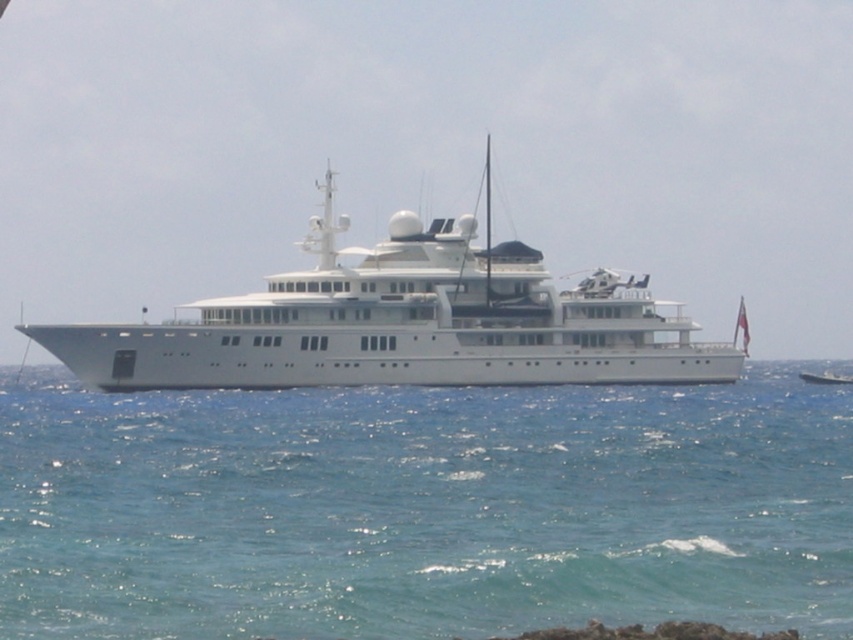
Is white glossy cruise ship at center shorter than white glossy yacht at center?

Incorrect, white glossy cruise ship at center's height does not fall short of white glossy yacht at center's.

Does white glossy cruise ship at center have a larger size compared to white glossy yacht at center?

Yes, white glossy cruise ship at center is bigger than white glossy yacht at center.

Does point (360, 374) come in front of point (828, 376)?

Yes, it is in front of point (828, 376).

At what (x,y) coordinates should I click in order to perform the action: click on white glossy cruise ship at center. Please return your answer as a coordinate pair (x, y). Looking at the image, I should click on (405, 323).

Does clear blue water at center have a greater width compared to white glossy cruise ship at center?

No, clear blue water at center is not wider than white glossy cruise ship at center.

Can you confirm if clear blue water at center is positioned below white glossy cruise ship at center?

Indeed, clear blue water at center is positioned under white glossy cruise ship at center.

Which is behind, point (482, 596) or point (103, 349)?

Point (103, 349)

You are a GUI agent. You are given a task and a screenshot of the screen. Output one action in this format:
    pyautogui.click(x=<x>, y=<y>)
    Task: Click on the clear blue water at center
    This screenshot has height=640, width=853.
    Given the screenshot: What is the action you would take?
    pyautogui.click(x=422, y=508)

Does clear blue water at center appear on the right side of white glossy yacht at center?

Incorrect, clear blue water at center is not on the right side of white glossy yacht at center.

Does clear blue water at center have a larger size compared to white glossy yacht at center?

Correct, clear blue water at center is larger in size than white glossy yacht at center.

This screenshot has width=853, height=640. What do you see at coordinates (422, 508) in the screenshot? I see `clear blue water at center` at bounding box center [422, 508].

Locate an element on the screen. This screenshot has height=640, width=853. clear blue water at center is located at coordinates (422, 508).